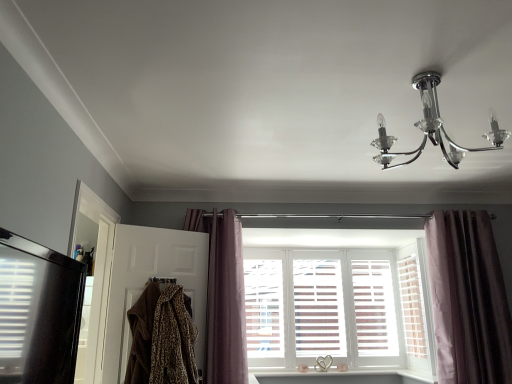
What do you see at coordinates (415, 305) in the screenshot? I see `white wood shutter at center` at bounding box center [415, 305].

Where is `brown fur coat at left, which ranks as the 1th screen door in right-to-left order`? The width and height of the screenshot is (512, 384). brown fur coat at left, which ranks as the 1th screen door in right-to-left order is located at coordinates (147, 280).

Where is `black glossy refrigerator at left, placed as the 1th screen door when sorted from left to right`? Image resolution: width=512 pixels, height=384 pixels. black glossy refrigerator at left, placed as the 1th screen door when sorted from left to right is located at coordinates (92, 276).

Locate an element on the screen. Image resolution: width=512 pixels, height=384 pixels. white wood shutter at center is located at coordinates (415, 305).

From a real-world perspective, which object stands above the other?

white wooden window at center.

Measure the distance between leopard print fabric at lower left and white wooden window at center.

The distance of leopard print fabric at lower left from white wooden window at center is 5.13 feet.

Can you confirm if leopard print fabric at lower left is smaller than white wooden window at center?

→ Correct, leopard print fabric at lower left occupies less space than white wooden window at center.

From a real-world perspective, is white wooden window at center positioned under white wood shutter at center based on gravity?

No.

Considering the relative positions of white wooden window at center and white wood shutter at center in the image provided, is white wooden window at center to the left of white wood shutter at center from the viewer's perspective?

Yes.

From the image's perspective, would you say white wooden window at center is shown under white wood shutter at center?

Yes, from the image's perspective, white wooden window at center is below white wood shutter at center.

Could you tell me if white wooden window at center is turned towards white wood shutter at center?

Yes, white wooden window at center is facing white wood shutter at center.

In the scene shown: From the image's perspective, is velvet purple curtain at right, which ranks as the second curtain in left-to-right order, beneath brown fur coat at left, which ranks as the 1th screen door in right-to-left order?

Incorrect, from the image's perspective, velvet purple curtain at right, which ranks as the second curtain in left-to-right order, is higher than brown fur coat at left, which ranks as the 1th screen door in right-to-left order.

Choose the correct answer: Is velvet purple curtain at right, which ranks as the second curtain in left-to-right order, inside brown fur coat at left, which ranks as the 1th screen door in right-to-left order, or outside it?

velvet purple curtain at right, which ranks as the second curtain in left-to-right order, lies outside brown fur coat at left, which ranks as the 1th screen door in right-to-left order.

What's the angular difference between velvet purple curtain at right, which ranks as the second curtain in left-to-right order, and brown fur coat at left, which ranks as the 1th screen door in right-to-left order,'s facing directions?

27.4 degrees separate the facing orientations of velvet purple curtain at right, which ranks as the second curtain in left-to-right order, and brown fur coat at left, which ranks as the 1th screen door in right-to-left order.

The width and height of the screenshot is (512, 384). What are the coordinates of `curtain that is the 2nd object to the right of the brown fur coat at left, which appears as the 2th screen door when viewed from the left, starting at the anchor` in the screenshot? It's located at (468, 299).

Considering the sizes of objects clear glass chandelier at upper right and white wooden window at center in the image provided, who is bigger, clear glass chandelier at upper right or white wooden window at center?

clear glass chandelier at upper right.

Considering the sizes of objects clear glass chandelier at upper right and white wooden window at center in the image provided, who is shorter, clear glass chandelier at upper right or white wooden window at center?

Standing shorter between the two is clear glass chandelier at upper right.

Which is nearer, (442,131) or (314,249)?

Point (442,131).

From a real-world perspective, which object rests below the other?

white wooden window at center, from a real-world perspective.

Is black glossy refrigerator at left, placed as the 1th screen door when sorted from left to right, completely or partially outside of white wood shutter at center?

Yes.

Measure the distance between black glossy refrigerator at left, acting as the second screen door starting from the right, and white wood shutter at center.

black glossy refrigerator at left, acting as the second screen door starting from the right, and white wood shutter at center are 9.14 feet apart.

In terms of width, does black glossy refrigerator at left, placed as the 1th screen door when sorted from left to right, look wider or thinner when compared to white wood shutter at center?

In the image, black glossy refrigerator at left, placed as the 1th screen door when sorted from left to right, appears to be wider than white wood shutter at center.

From a real-world perspective, which is physically above, black glossy refrigerator at left, placed as the 1th screen door when sorted from left to right, or white wood shutter at center?

From a 3D spatial view, black glossy refrigerator at left, placed as the 1th screen door when sorted from left to right, is above.

Is point (410, 324) more distant than point (90, 250)?

Yes.

Is white wood shutter at center aimed at black glossy refrigerator at left, acting as the second screen door starting from the right?

No, white wood shutter at center is not turned towards black glossy refrigerator at left, acting as the second screen door starting from the right.

What's the angular difference between white wood shutter at center and black glossy refrigerator at left, acting as the second screen door starting from the right,'s facing directions?

The facing directions of white wood shutter at center and black glossy refrigerator at left, acting as the second screen door starting from the right, are 179 degrees apart.

From the picture: Is white wood shutter at center smaller than black glossy refrigerator at left, placed as the 1th screen door when sorted from left to right?

Yes, white wood shutter at center is smaller than black glossy refrigerator at left, placed as the 1th screen door when sorted from left to right.

Is velvet purple curtain at right, which ranks as the second curtain in left-to-right order, further to camera compared to leopard print fabric at lower left?

Yes.

Is point (493, 363) less distant than point (169, 323)?

That is False.

Locate an element on the screen. window to the right of leopard print fabric at lower left is located at coordinates (337, 298).

Identify the location of window that is behind the white wood shutter at center. This screenshot has width=512, height=384. (337, 298).

Based on their spatial positions, is brown fur coat at left, which appears as the 2th screen door when viewed from the left, or black glossy refrigerator at left, acting as the second screen door starting from the right, further from leopard print fabric at lower left?

black glossy refrigerator at left, acting as the second screen door starting from the right, is positioned further to the anchor leopard print fabric at lower left.

Based on their spatial positions, is leopard print fabric at lower left or mauve velvet curtain at center, arranged as the 1th curtain when viewed from the left, closer to white wood shutter at center?

Based on the image, mauve velvet curtain at center, arranged as the 1th curtain when viewed from the left, appears to be nearer to white wood shutter at center.

Based on their spatial positions, is clear glass chandelier at upper right or white wooden window at center further from white wood shutter at center?

→ clear glass chandelier at upper right lies further to white wood shutter at center than the other object.

Based on their spatial positions, is leopard print fabric at lower left or clear glass chandelier at upper right further from velvet purple curtain at right, the first curtain viewed from the right?

Among the two, leopard print fabric at lower left is located further to velvet purple curtain at right, the first curtain viewed from the right.

Considering their positions, is velvet purple curtain at right, which ranks as the second curtain in left-to-right order, positioned further to mauve velvet curtain at center, the second curtain when ordered from right to left, than clear glass chandelier at upper right?

velvet purple curtain at right, which ranks as the second curtain in left-to-right order.

Based on their spatial positions, is mauve velvet curtain at center, arranged as the 1th curtain when viewed from the left, or white wooden window at center closer to clear glass chandelier at upper right?

mauve velvet curtain at center, arranged as the 1th curtain when viewed from the left.

Looking at the image, which one is located closer to brown fur coat at left, which ranks as the 1th screen door in right-to-left order, mauve velvet curtain at center, arranged as the 1th curtain when viewed from the left, or black glossy refrigerator at left, placed as the 1th screen door when sorted from left to right?

mauve velvet curtain at center, arranged as the 1th curtain when viewed from the left, is closer to brown fur coat at left, which ranks as the 1th screen door in right-to-left order.

Based on their spatial positions, is white wooden window at center or brown fur coat at left, which appears as the 2th screen door when viewed from the left, further from mauve velvet curtain at center, arranged as the 1th curtain when viewed from the left?

Based on the image, white wooden window at center appears to be further to mauve velvet curtain at center, arranged as the 1th curtain when viewed from the left.

You are a GUI agent. You are given a task and a screenshot of the screen. Output one action in this format:
    pyautogui.click(x=<x>, y=<y>)
    Task: Click on the lamp situated between mauve velvet curtain at center, the second curtain when ordered from right to left, and velvet purple curtain at right, which ranks as the second curtain in left-to-right order, from left to right
    
    Given the screenshot: What is the action you would take?
    pyautogui.click(x=432, y=128)

Image resolution: width=512 pixels, height=384 pixels. In order to click on clothing between black glossy refrigerator at left, placed as the 1th screen door when sorted from left to right, and white wooden window at center in the front-back direction in this screenshot , I will do `click(162, 337)`.

I want to click on clothing between black glossy refrigerator at left, placed as the 1th screen door when sorted from left to right, and clear glass chandelier at upper right, so click(x=162, y=337).

What are the coordinates of `clothing between clear glass chandelier at upper right and mauve velvet curtain at center, the second curtain when ordered from right to left, along the z-axis` in the screenshot? It's located at (162, 337).